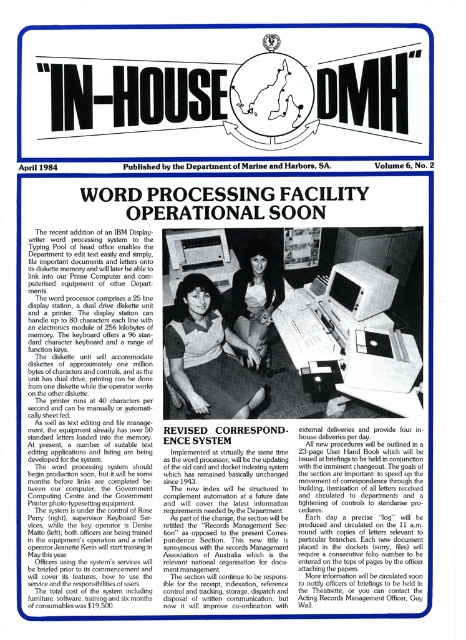
Between point (198, 321) and point (247, 292), which one is positioned in front?

Point (198, 321) is in front.

Is point (211, 326) positioned before point (257, 288)?

Yes.

Is point (199, 307) farther from viewer compared to point (232, 294)?

No, (199, 307) is in front of (232, 294).

Image resolution: width=466 pixels, height=640 pixels. I want to click on matte black shirt at center, so click(x=208, y=355).

Which is below, matte black shirt at center or white fabric-covered computer at center?

Positioned lower is matte black shirt at center.

Is point (205, 340) in front of point (344, 264)?

Yes, it is.

This screenshot has height=640, width=466. I want to click on matte black shirt at center, so click(x=208, y=355).

Is matte black hair at center to the right of white fabric-covered computer at center from the viewer's perspective?

Incorrect, matte black hair at center is not on the right side of white fabric-covered computer at center.

Is point (241, 289) in front of point (338, 301)?

That is False.

What do you see at coordinates (255, 296) in the screenshot? I see `matte black hair at center` at bounding box center [255, 296].

I want to click on matte black hair at center, so click(255, 296).